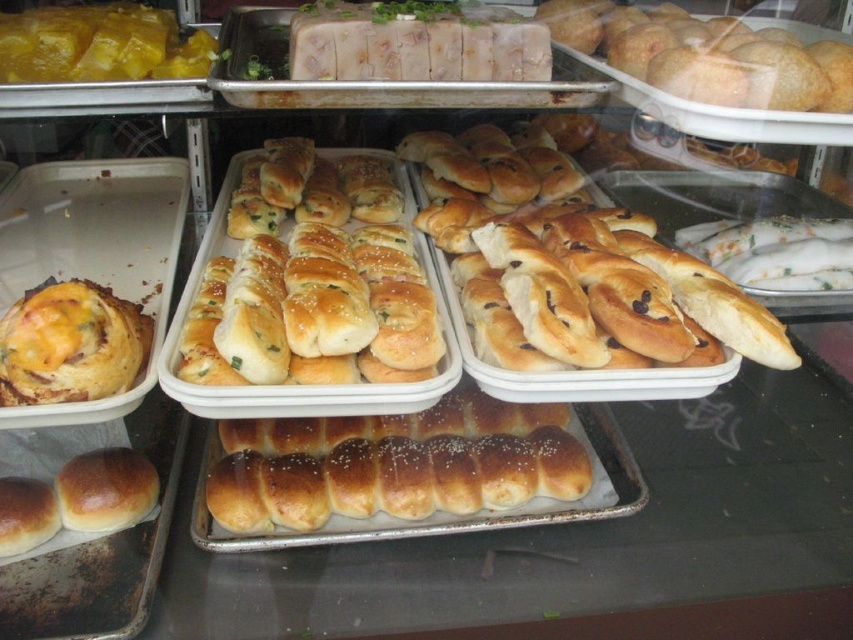
You are a customer at the bakery and want to buy both the golden brown crusty rolls at center and the yellow matte cheese at upper left. However, your bag can only hold one item. Which item should you choose if you want to carry the larger item?

The golden brown crusty rolls at center is bigger than the yellow matte cheese at upper left, so you should choose the golden brown crusty rolls at center to carry the larger item.

From the picture: You are a customer at the bakery and want to choose between the golden brown doughnut at center and the yellow cheesy bread at left. Which one is taller?

The golden brown doughnut at center is taller than the yellow cheesy bread at left.

You are a customer at the bakery and want to grab both the golden brown doughnut at center and the yellow cheesy bread at left. Since you can only reach one item at a time, which one should you take first based on their positions?

You should take the golden brown doughnut at center first because it is positioned over the yellow cheesy bread at left, meaning it is closer to you. After taking it, you can then reach for the yellow cheesy bread at left.